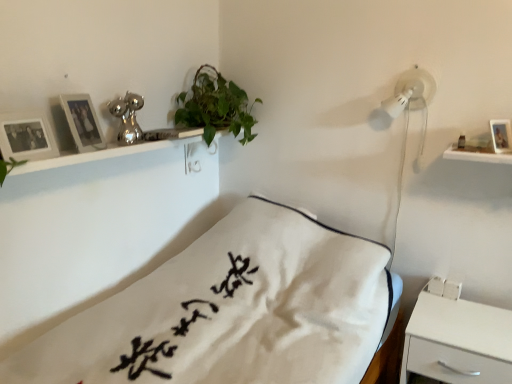
What is the approximate width of matte silver picture frame at upper left, which ranks as the 2th picture frame in left-to-right order?

matte silver picture frame at upper left, which ranks as the 2th picture frame in left-to-right order, is 3.69 centimeters wide.

Locate an element on the screen. The image size is (512, 384). white matte nightstand at lower right is located at coordinates (457, 339).

What is the approximate height of white matte nightstand at lower right?

19.64 inches.

Identify the location of wooden photo frame at upper right, which is the 1th picture frame in right-to-left order. (501, 135).

The height and width of the screenshot is (384, 512). I want to click on wooden photo frame at upper left, the 3th picture frame from the right, so click(x=27, y=137).

Does matte silver picture frame at upper left, which ranks as the 2th picture frame in left-to-right order, contain green leafy plant at upper center?

That's incorrect, green leafy plant at upper center is not inside matte silver picture frame at upper left, which ranks as the 2th picture frame in left-to-right order.

What are the coordinates of `houseplant that appears above the matte silver picture frame at upper left, which is counted as the 2th picture frame, starting from the right (from the image's perspective)` in the screenshot? It's located at (215, 106).

From the picture: Considering the sizes of matte silver picture frame at upper left, which is counted as the 2th picture frame, starting from the right, and green leafy plant at upper center in the image, is matte silver picture frame at upper left, which is counted as the 2th picture frame, starting from the right, wider or thinner than green leafy plant at upper center?

matte silver picture frame at upper left, which is counted as the 2th picture frame, starting from the right, is thinner than green leafy plant at upper center.

Does matte silver picture frame at upper left, which is counted as the 2th picture frame, starting from the right, turn towards green leafy plant at upper center?

No, matte silver picture frame at upper left, which is counted as the 2th picture frame, starting from the right, does not turn towards green leafy plant at upper center.

From a real-world perspective, is white cotton pillow at center above or below white matte nightstand at lower right?

Clearly, from a real-world perspective, white cotton pillow at center is above white matte nightstand at lower right.

Is white cotton pillow at center bigger than white matte nightstand at lower right?

Indeed, white cotton pillow at center has a larger size compared to white matte nightstand at lower right.

Looking at this image, how distant is white cotton pillow at center from white matte nightstand at lower right?

A distance of 18.96 inches exists between white cotton pillow at center and white matte nightstand at lower right.

Does white cotton pillow at center turn towards white matte nightstand at lower right?

Yes, white cotton pillow at center is turned towards white matte nightstand at lower right.

Considering the relative sizes of white cotton pillow at center and wooden photo frame at upper right, which is the 1th picture frame in right-to-left order, in the image provided, is white cotton pillow at center smaller than wooden photo frame at upper right, which is the 1th picture frame in right-to-left order,?

No.

Between white cotton pillow at center and wooden photo frame at upper right, which is the 1th picture frame in right-to-left order, which one has smaller width?

Thinner between the two is wooden photo frame at upper right, which is the 1th picture frame in right-to-left order.

Would you say white cotton pillow at center is outside wooden photo frame at upper right, which is the 1th picture frame in right-to-left order?

That's correct, white cotton pillow at center is outside of wooden photo frame at upper right, which is the 1th picture frame in right-to-left order.

Can you tell me how much white cotton pillow at center and wooden photo frame at upper right, which is the 1th picture frame in right-to-left order, differ in facing direction?

The facing directions of white cotton pillow at center and wooden photo frame at upper right, which is the 1th picture frame in right-to-left order, are 43.7 degrees apart.

Looking at this image, from a real-world perspective, between white matte nightstand at lower right and matte silver picture frame at upper left, which is counted as the 2th picture frame, starting from the right, who is vertically higher?

In real-world perspective, matte silver picture frame at upper left, which is counted as the 2th picture frame, starting from the right, is above.

Considering the relative sizes of white matte nightstand at lower right and matte silver picture frame at upper left, which is counted as the 2th picture frame, starting from the right, in the image provided, is white matte nightstand at lower right bigger than matte silver picture frame at upper left, which is counted as the 2th picture frame, starting from the right,?

Yes.

From the image's perspective, which is above, white matte nightstand at lower right or matte silver picture frame at upper left, which is counted as the 2th picture frame, starting from the right?

matte silver picture frame at upper left, which is counted as the 2th picture frame, starting from the right, appears higher in the image.

Can you see white matte nightstand at lower right touching matte silver picture frame at upper left, which ranks as the 2th picture frame in left-to-right order?

No, white matte nightstand at lower right is not touching matte silver picture frame at upper left, which ranks as the 2th picture frame in left-to-right order.

Based on the photo, which object is positioned more to the right, white matte nightstand at lower right or white cotton pillow at center?

white matte nightstand at lower right is more to the right.

How distant is white matte nightstand at lower right from white cotton pillow at center?

A distance of 18.96 inches exists between white matte nightstand at lower right and white cotton pillow at center.

This screenshot has height=384, width=512. Find the location of `nightstand below the white cotton pillow at center (from a real-world perspective)`. nightstand below the white cotton pillow at center (from a real-world perspective) is located at coordinates (457, 339).

Which object is more forward, white matte nightstand at lower right or white cotton pillow at center?

Positioned in front is white cotton pillow at center.

Can we say wooden photo frame at upper right, the 3th picture frame when ordered from left to right, lies outside green leafy plant at upper center?

Yes, wooden photo frame at upper right, the 3th picture frame when ordered from left to right, is outside of green leafy plant at upper center.

Can you confirm if wooden photo frame at upper right, the 3th picture frame when ordered from left to right, is positioned to the left of green leafy plant at upper center?

No, wooden photo frame at upper right, the 3th picture frame when ordered from left to right, is not to the left of green leafy plant at upper center.

What's the angular difference between wooden photo frame at upper right, which is the 1th picture frame in right-to-left order, and green leafy plant at upper center's facing directions?

The facing directions of wooden photo frame at upper right, which is the 1th picture frame in right-to-left order, and green leafy plant at upper center are 45 degrees apart.

Is wooden photo frame at upper right, the 3th picture frame when ordered from left to right, shorter than green leafy plant at upper center?

Correct, wooden photo frame at upper right, the 3th picture frame when ordered from left to right, is not as tall as green leafy plant at upper center.

Which of these two, matte silver picture frame at upper left, which is counted as the 2th picture frame, starting from the right, or wooden photo frame at upper left, the first picture frame in the left-to-right sequence, is thinner?

Thinner between the two is matte silver picture frame at upper left, which is counted as the 2th picture frame, starting from the right.

From a real-world perspective, which object rests below the other?

In real-world perspective, wooden photo frame at upper left, the first picture frame in the left-to-right sequence, is lower.

In terms of height, does matte silver picture frame at upper left, which ranks as the 2th picture frame in left-to-right order, look taller or shorter compared to wooden photo frame at upper left, the 3th picture frame from the right?

Clearly, matte silver picture frame at upper left, which ranks as the 2th picture frame in left-to-right order, is taller compared to wooden photo frame at upper left, the 3th picture frame from the right.

The image size is (512, 384). I want to click on the 2nd picture frame in front of the green leafy plant at upper center, so click(83, 122).

Find the location of a particular element. bed above the white matte nightstand at lower right (from the image's perspective) is located at coordinates (232, 311).

In the scene shown: Looking at the image, which one is located closer to wooden photo frame at upper right, the 3th picture frame when ordered from left to right, wooden photo frame at upper left, the 3th picture frame from the right, or white matte nightstand at lower right?

white matte nightstand at lower right lies closer to wooden photo frame at upper right, the 3th picture frame when ordered from left to right, than the other object.

Estimate the real-world distances between objects in this image. Which object is closer to matte silver picture frame at upper left, which ranks as the 2th picture frame in left-to-right order, wooden photo frame at upper left, the 3th picture frame from the right, or white cotton pillow at center?

wooden photo frame at upper left, the 3th picture frame from the right, is positioned closer to the anchor matte silver picture frame at upper left, which ranks as the 2th picture frame in left-to-right order.

When comparing their distances from white cotton pillow at center, does wooden photo frame at upper left, the first picture frame in the left-to-right sequence, or green leafy plant at upper center seem closer?

Among the two, green leafy plant at upper center is located nearer to white cotton pillow at center.

Estimate the real-world distances between objects in this image. Which object is closer to wooden photo frame at upper right, which is the 1th picture frame in right-to-left order, wooden photo frame at upper left, the 3th picture frame from the right, or matte silver picture frame at upper left, which is counted as the 2th picture frame, starting from the right?

matte silver picture frame at upper left, which is counted as the 2th picture frame, starting from the right, is positioned closer to the anchor wooden photo frame at upper right, which is the 1th picture frame in right-to-left order.

When comparing their distances from wooden photo frame at upper right, the 3th picture frame when ordered from left to right, does wooden photo frame at upper left, the first picture frame in the left-to-right sequence, or green leafy plant at upper center seem further?

The object further to wooden photo frame at upper right, the 3th picture frame when ordered from left to right, is wooden photo frame at upper left, the first picture frame in the left-to-right sequence.

Estimate the real-world distances between objects in this image. Which object is closer to wooden photo frame at upper left, the 3th picture frame from the right, wooden photo frame at upper right, the 3th picture frame when ordered from left to right, or matte silver picture frame at upper left, which ranks as the 2th picture frame in left-to-right order?

Based on the image, matte silver picture frame at upper left, which ranks as the 2th picture frame in left-to-right order, appears to be nearer to wooden photo frame at upper left, the 3th picture frame from the right.

Estimate the real-world distances between objects in this image. Which object is closer to matte silver picture frame at upper left, which ranks as the 2th picture frame in left-to-right order, wooden photo frame at upper right, which is the 1th picture frame in right-to-left order, or white matte nightstand at lower right?

wooden photo frame at upper right, which is the 1th picture frame in right-to-left order.

Based on their spatial positions, is white matte nightstand at lower right or wooden photo frame at upper right, which is the 1th picture frame in right-to-left order, further from green leafy plant at upper center?

The object further to green leafy plant at upper center is white matte nightstand at lower right.

Locate an element on the screen. picture frame between wooden photo frame at upper left, the 3th picture frame from the right, and wooden photo frame at upper right, the 3th picture frame when ordered from left to right, in the horizontal direction is located at coordinates (83, 122).

I want to click on picture frame located between wooden photo frame at upper left, the first picture frame in the left-to-right sequence, and white matte nightstand at lower right in the left-right direction, so click(x=83, y=122).

The width and height of the screenshot is (512, 384). Identify the location of houseplant between matte silver picture frame at upper left, which is counted as the 2th picture frame, starting from the right, and wooden photo frame at upper right, which is the 1th picture frame in right-to-left order. (215, 106).

You are a GUI agent. You are given a task and a screenshot of the screen. Output one action in this format:
    pyautogui.click(x=<x>, y=<y>)
    Task: Click on the nightstand situated between white cotton pillow at center and wooden photo frame at upper right, which is the 1th picture frame in right-to-left order, from left to right
    This screenshot has height=384, width=512.
    Given the screenshot: What is the action you would take?
    pyautogui.click(x=457, y=339)